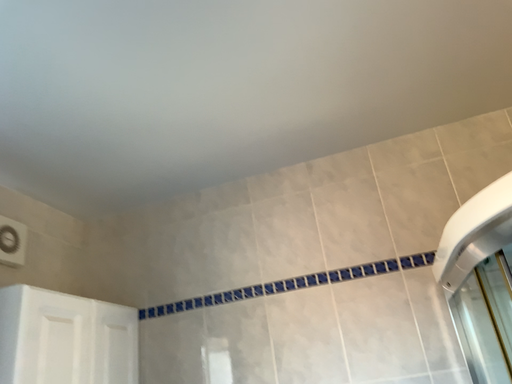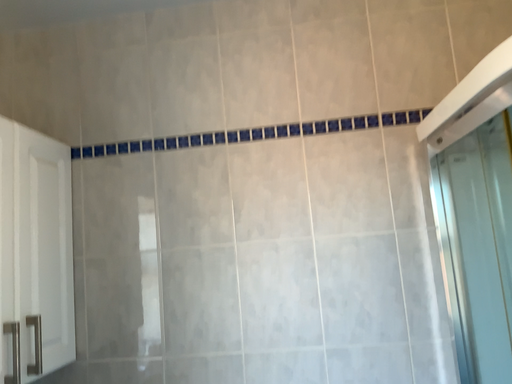
Question: Which way did the camera rotate in the video?

Choices:
 (A) rotated upward
 (B) rotated downward

Answer: (B)